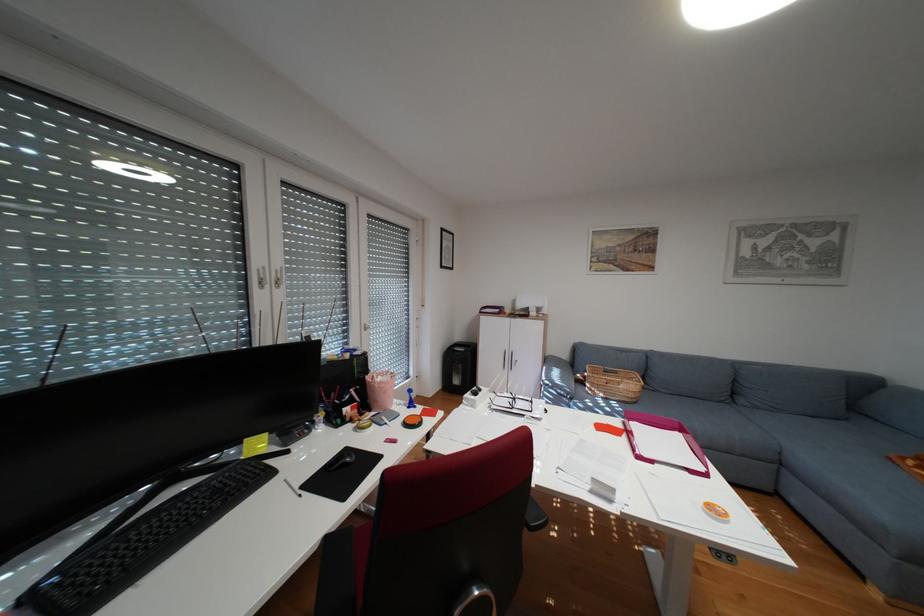
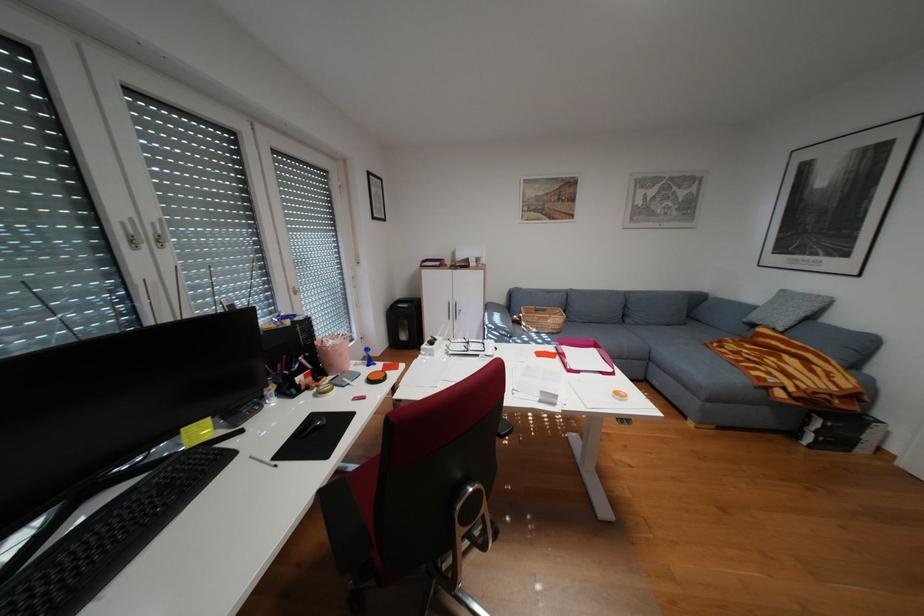
Question: In a continuous first-person perspective shot, in which direction is the camera moving?

Choices:
 (A) Left
 (B) Right
 (C) Forward
 (D) Backward

Answer: (A)